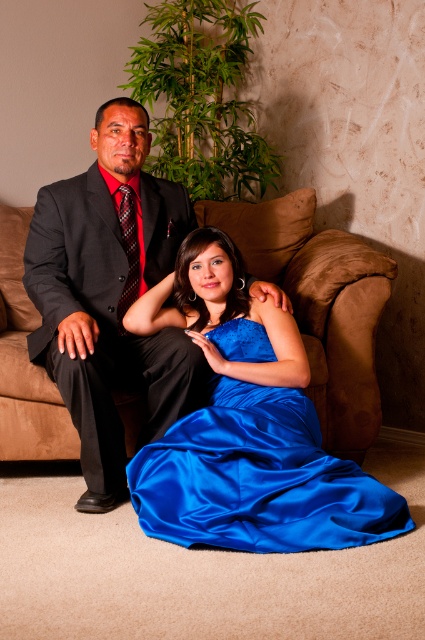
You are a photographer setting up for a portrait session. You have a backdrop that is 2 meters wide. The two subjects are wearing the satin blue dress at center and the black satin suit at left. Based on their clothing widths, which outfit will require more space to ensure it doesn not touch the backdrop?

The satin blue dress at center has a greater width than the black satin suit at left, so it will require more space to prevent it from touching the backdrop.